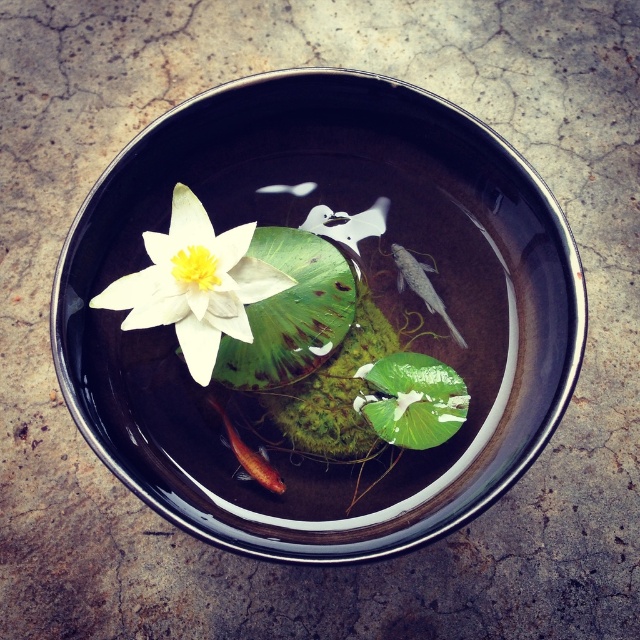
You are a small toy boat that is 2 centimeters long. You want to sail from the white matte flower at center to the shiny orange fish at center. Can you fit between them without touching either?

The distance between the white matte flower at center and the shiny orange fish at center is 2.18 centimeters. Since the boat is 2 centimeters long, there is enough space for it to pass between them without touching either object.

You are holding a small toy boat that is 2 inches long. You want to place it on the surface of the water in the bowl so that it stays afloat. Considering the position of the point at coordinates point (x=154, y=234), which is part of the aquatic scene, can you determine if the boat will fit without overlapping with any objects at that location?

The point at coordinates point (x=154, y=234) is 5.99 inches from the viewer. Since the boat is only 2 inches long, there should be enough space for it to float at that location without overlapping with other objects, provided the surface is clear.

You are observing the aquatic scene in the bowl. There are two points marked as point 1 at coordinates (198, 374) and point 2 at coordinates (250, 460). Which point is closer to your viewpoint?

Point 1 at coordinates (198, 374) is closer to the camera than point 2 at coordinates (250, 460).